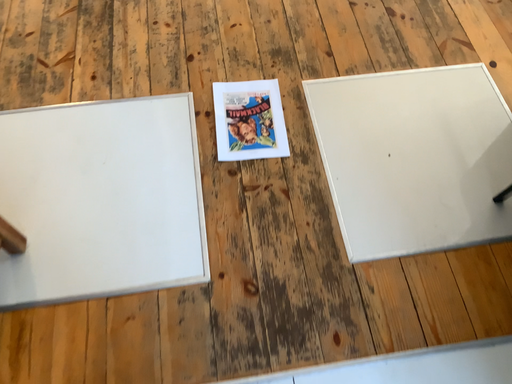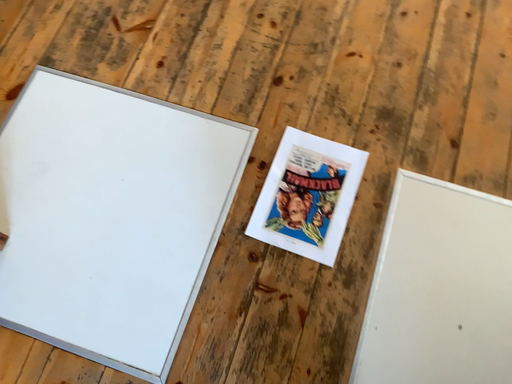
Question: How did the camera likely rotate when shooting the video?

Choices:
 (A) rotated right
 (B) rotated left

Answer: (B)